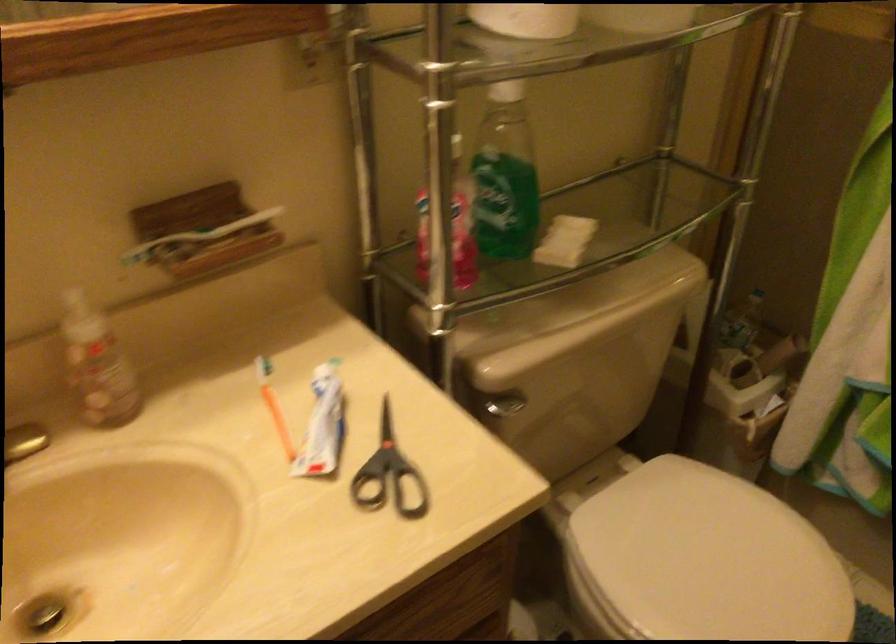
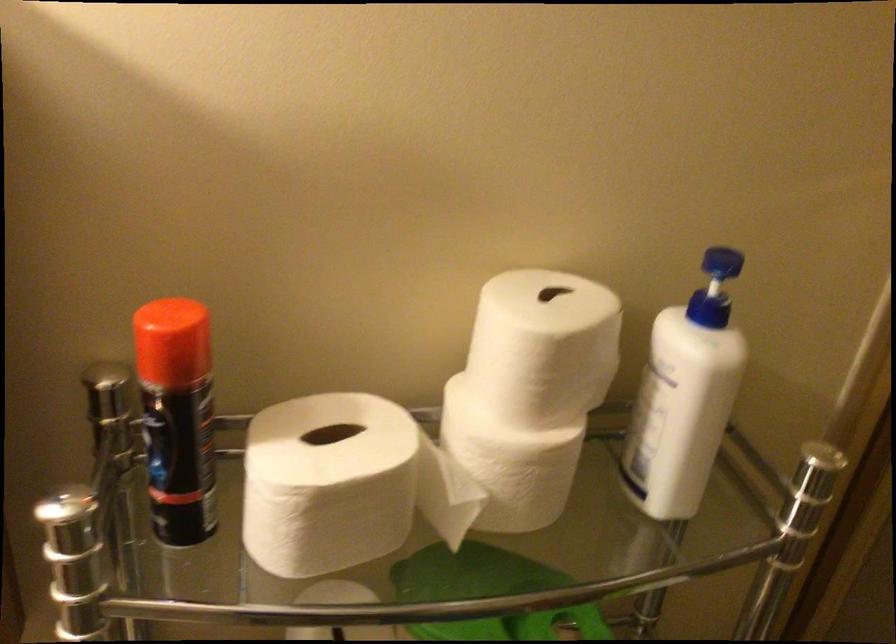
Question: The first image is from the beginning of the video and the second image is from the end. How did the camera likely rotate when shooting the video?

Choices:
 (A) Left
 (B) Right
 (C) Up
 (D) Down

Answer: (A)